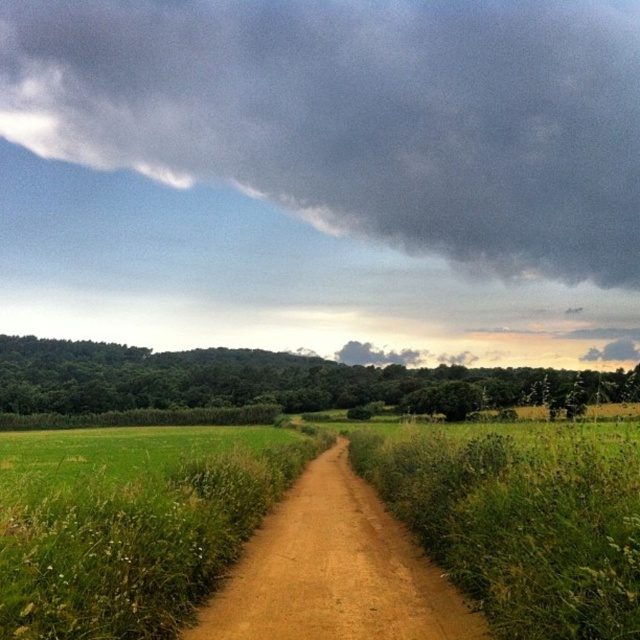
Question: Which point appears closest to the camera in this image?

Choices:
 (A) (364, 540)
 (B) (236, 160)

Answer: (A)

Question: Does dark gray cloud at upper center come in front of brown dirt track at center?

Choices:
 (A) yes
 (B) no

Answer: (B)

Question: Is dark gray cloud at upper center further to the viewer compared to brown dirt track at center?

Choices:
 (A) yes
 (B) no

Answer: (A)

Question: Does dark gray cloud at upper center appear on the left side of brown dirt track at center?

Choices:
 (A) no
 (B) yes

Answer: (B)

Question: Which of the following is the closest to the observer?

Choices:
 (A) brown dirt track at center
 (B) dark gray cloud at upper center

Answer: (A)